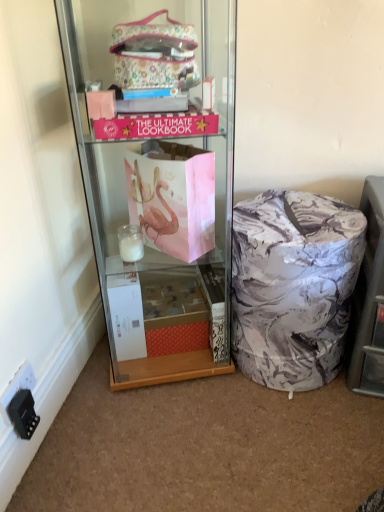
Question: Should I look upward or downward to see marble-patterned laundry basket at lower right?

Choices:
 (A) up
 (B) down

Answer: (B)

Question: Does marble-patterned laundry basket at lower right come in front of matte pink paper bag at center?

Choices:
 (A) yes
 (B) no

Answer: (B)

Question: Is marble-patterned laundry basket at lower right to the left of matte pink paper bag at center from the viewer's perspective?

Choices:
 (A) no
 (B) yes

Answer: (A)

Question: Is marble-patterned laundry basket at lower right with matte pink paper bag at center?

Choices:
 (A) yes
 (B) no

Answer: (B)

Question: From the image's perspective, is marble-patterned laundry basket at lower right under matte pink paper bag at center?

Choices:
 (A) yes
 (B) no

Answer: (A)

Question: Is marble-patterned laundry basket at lower right shorter than matte pink paper bag at center?

Choices:
 (A) no
 (B) yes

Answer: (B)

Question: From the image's perspective, is marble-patterned laundry basket at lower right above matte pink paper bag at center?

Choices:
 (A) no
 (B) yes

Answer: (A)

Question: Does black plastic power outlet at lower left have a lesser height compared to matte pink paper bag at center?

Choices:
 (A) yes
 (B) no

Answer: (A)

Question: Considering the relative sizes of black plastic power outlet at lower left and matte pink paper bag at center in the image provided, is black plastic power outlet at lower left bigger than matte pink paper bag at center?

Choices:
 (A) yes
 (B) no

Answer: (B)

Question: From the image's perspective, is black plastic power outlet at lower left below matte pink paper bag at center?

Choices:
 (A) no
 (B) yes

Answer: (B)

Question: Does black plastic power outlet at lower left lie in front of matte pink paper bag at center?

Choices:
 (A) yes
 (B) no

Answer: (B)

Question: Is black plastic power outlet at lower left not within matte pink paper bag at center?

Choices:
 (A) yes
 (B) no

Answer: (A)

Question: Does black plastic power outlet at lower left have a smaller size compared to matte pink paper bag at center?

Choices:
 (A) yes
 (B) no

Answer: (A)

Question: Does marble-patterned ottoman at lower right have a larger size compared to black plastic power outlet at lower left?

Choices:
 (A) no
 (B) yes

Answer: (B)